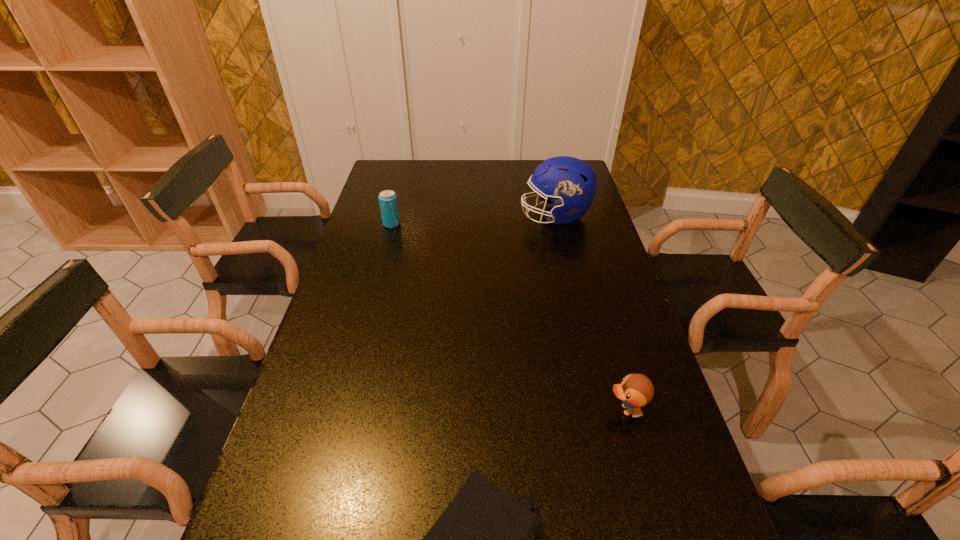
Identify the location of football helmet. (571, 183).

The height and width of the screenshot is (540, 960). What are the coordinates of `soda can` in the screenshot? It's located at (387, 199).

Image resolution: width=960 pixels, height=540 pixels. In order to click on duck in this screenshot , I will do `click(636, 390)`.

Where is `free space located on the front-facing side of the football helmet`? The height and width of the screenshot is (540, 960). free space located on the front-facing side of the football helmet is located at coordinates (441, 215).

Locate an element on the screen. The height and width of the screenshot is (540, 960). free space located 0.160m on the front-facing side of the football helmet is located at coordinates (476, 215).

Where is `vacant space located 0.080m on the front-facing side of the football helmet`? Image resolution: width=960 pixels, height=540 pixels. vacant space located 0.080m on the front-facing side of the football helmet is located at coordinates (498, 215).

Find the location of a particular element. The height and width of the screenshot is (540, 960). vacant area located 0.060m on the left of the soda can is located at coordinates (366, 224).

Where is `vacant space located 0.150m on the front-facing side of the duck`? The width and height of the screenshot is (960, 540). vacant space located 0.150m on the front-facing side of the duck is located at coordinates click(x=540, y=409).

Locate an element on the screen. vacant space located on the front-facing side of the duck is located at coordinates (492, 409).

Identify the location of free region located on the front-facing side of the duck. This screenshot has width=960, height=540. (462, 409).